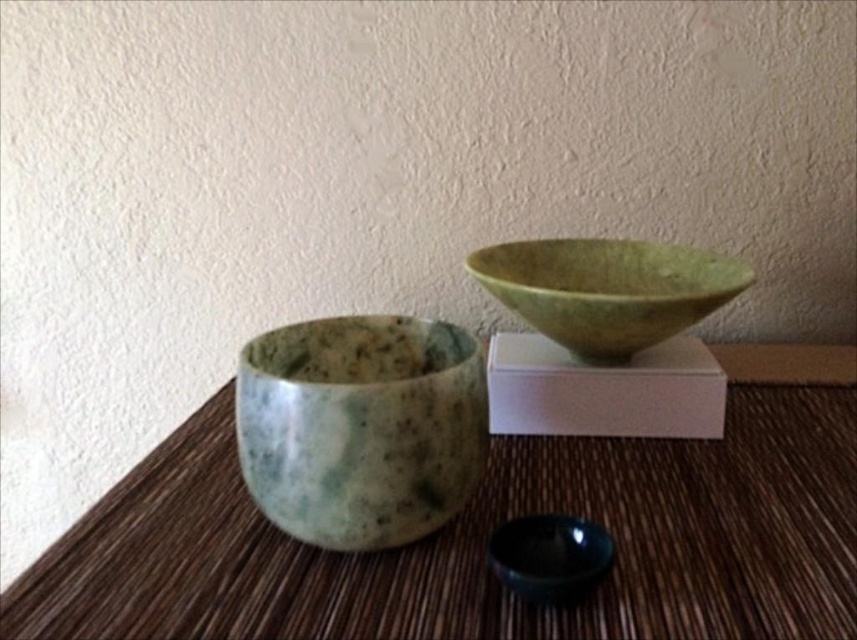
You are arranging these bowls on a shelf that can only hold items up to 15 cm in height. The speckled stone bowl at center and the black glossy bowl at lower center are both in front of you. Which bowl should you choose to place on the shelf if you want the tallest one?

The speckled stone bowl at center is much taller than the black glossy bowl at lower center, so you should choose the speckled stone bowl at center to place on the shelf if you want the tallest one.

You have a small decorative item that is 3 inches wide. You want to place it between the speckled stone bowl at center and the black glossy bowl at lower center. Is there enough space for it?

The distance between the speckled stone bowl at center and the black glossy bowl at lower center is 5.20 inches. Since the decorative item is 3 inches wide, there is sufficient space to place it between them.

You are arranging items on a table and have a brown woven mat at center and a black glossy bowl at lower center. Which item do you need to adjust if you want to ensure both items fit within a 12 inch diameter circle?

The brown woven mat at center is larger in size than the black glossy bowl at lower center, so you should adjust the position of the brown woven mat at center to ensure it fits within the 12 inch diameter circle.